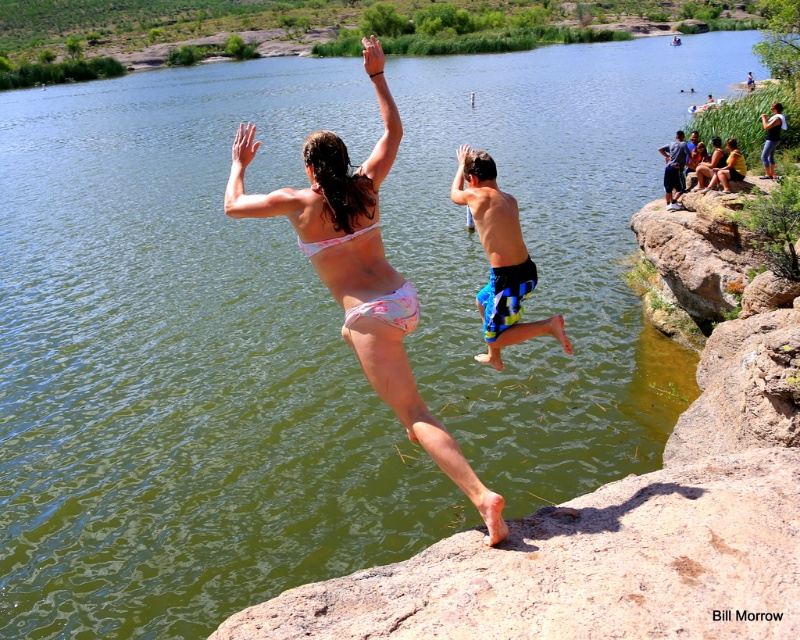
Question: Estimate the real-world distances between objects in this image. Which object is closer to the blue plaid shorts at center?

Choices:
 (A) pink fabric bikini top at center
 (B) pink floral bikini top at center
 (C) dark blue shorts at right
 (D) denim shorts at upper right

Answer: (B)

Question: Is blue plaid shorts at center to the right of pink floral bikini top at center from the viewer's perspective?

Choices:
 (A) no
 (B) yes

Answer: (B)

Question: Which point is farther to the camera?

Choices:
 (A) (330, 131)
 (B) (766, 177)
 (C) (308, 256)

Answer: (A)

Question: Does white floral bikini bottom at center come behind pink fabric bikini top at center?

Choices:
 (A) yes
 (B) no

Answer: (B)

Question: In this image, where is white floral bikini bottom at center located relative to blue plaid shorts at center?

Choices:
 (A) left
 (B) right

Answer: (A)

Question: Which point is closer to the camera taking this photo?

Choices:
 (A) (326, 241)
 (B) (536, 326)
 (C) (310, 250)

Answer: (A)